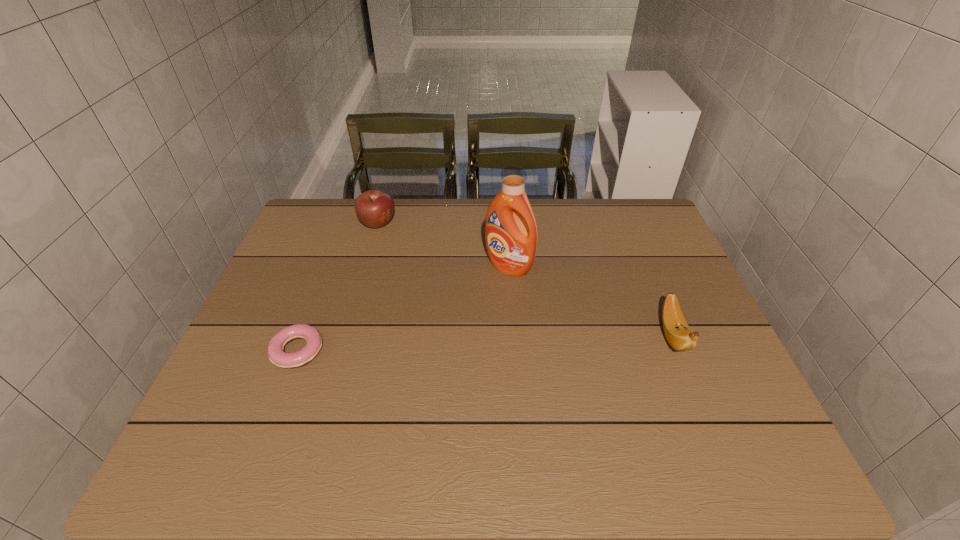
Identify the location of doughnut. The width and height of the screenshot is (960, 540). (277, 356).

This screenshot has height=540, width=960. I want to click on banana, so click(679, 335).

At what (x,y) coordinates should I click in order to perform the action: click on the farthest object. Please return your answer as a coordinate pair (x, y). The height and width of the screenshot is (540, 960). Looking at the image, I should click on (374, 208).

Where is `the third object from left to right`? This screenshot has width=960, height=540. the third object from left to right is located at coordinates (511, 247).

Identify the location of detergent. This screenshot has height=540, width=960. (511, 247).

This screenshot has height=540, width=960. Identify the location of vacant space located on the right of the shortest object. (386, 350).

Where is `free space located 0.170m on the left of the banana`? free space located 0.170m on the left of the banana is located at coordinates (591, 335).

Where is `free space located 0.170m on the side of the farthest object with the unique marking`? This screenshot has width=960, height=540. free space located 0.170m on the side of the farthest object with the unique marking is located at coordinates (401, 266).

In order to click on vacant space located 0.320m on the side of the farthest object with the unique marking in this screenshot , I will do `click(420, 299)`.

Find the location of a particular element. The image size is (960, 540). vacant space located 0.330m on the side of the farthest object with the unique marking is located at coordinates (422, 301).